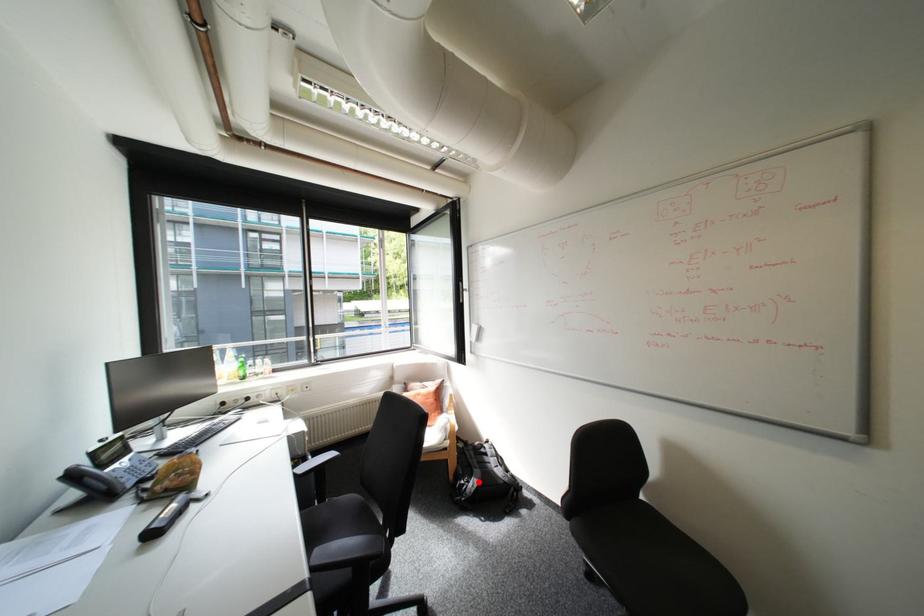
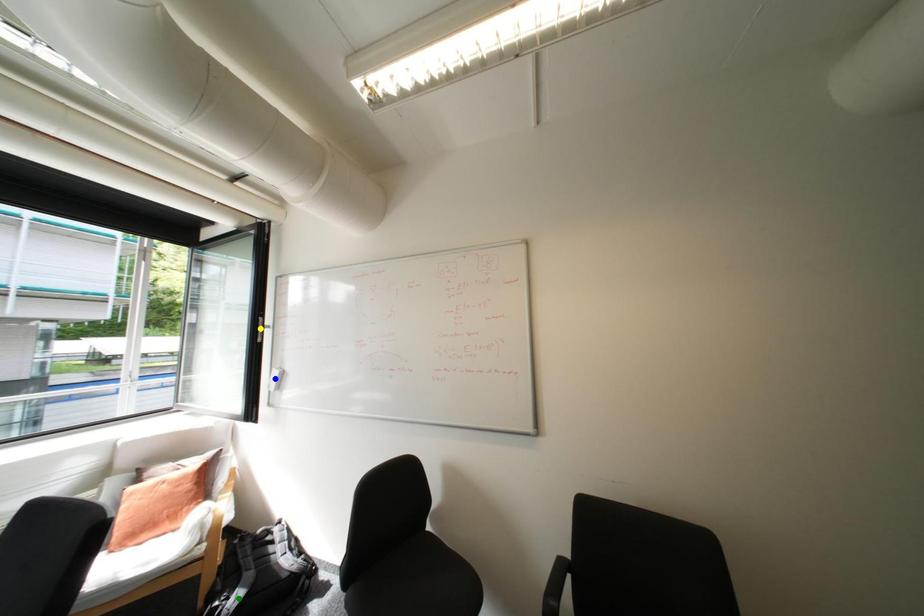
Question: I am providing you with two images of the same scene from different viewpoints. A red point is marked on the first image. You are given multiple points on the second image. Can you choose the point in image 2 that corresponds to the point in image 1?

Choices:
 (A) yellow point
 (B) green point
 (C) blue point

Answer: (B)